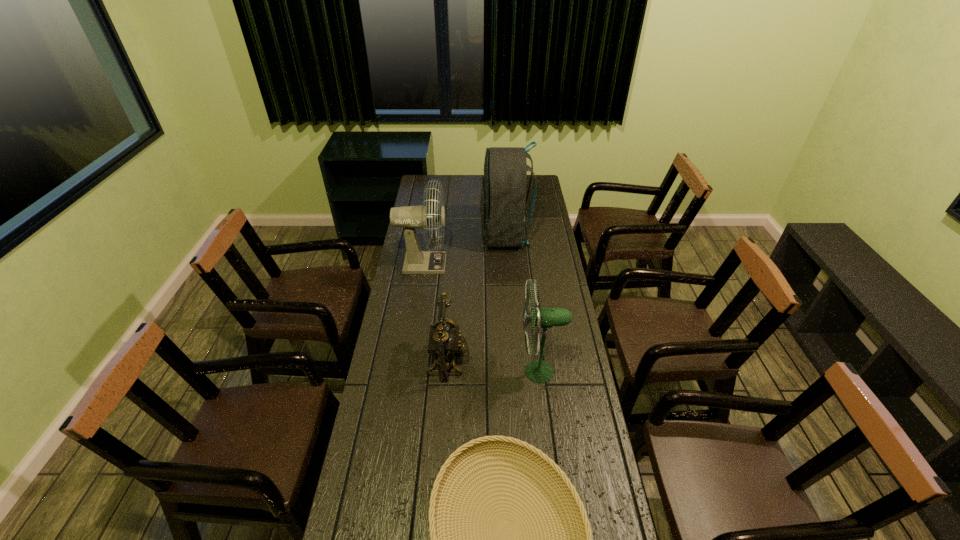
This screenshot has height=540, width=960. What are the coordinates of `free space between the second shortest object and the tallest object` in the screenshot? It's located at (477, 298).

The height and width of the screenshot is (540, 960). Find the location of `empty space that is in between the right fan and the telephone`. empty space that is in between the right fan and the telephone is located at coordinates (494, 366).

Image resolution: width=960 pixels, height=540 pixels. I want to click on vacant area that lies between the tallest object and the nearer fan, so click(x=522, y=303).

At what (x,y) coordinates should I click in order to perform the action: click on vacant point located between the fourth tallest object and the left fan. Please return your answer as a coordinate pair (x, y). Looking at the image, I should click on (436, 313).

Identify the location of free space that is in between the tallest object and the left fan. The image size is (960, 540). (464, 249).

Choose which object is the fourth nearest neighbor to the backpack. Please provide its 2D coordinates. Your answer should be formatted as a tuple, i.e. [(x, y)], where the tuple contains the x and y coordinates of a point satisfying the conditions above.

[(442, 488)]

Locate an element on the screen. The width and height of the screenshot is (960, 540). object that stands as the third closest to the tallest object is located at coordinates (539, 371).